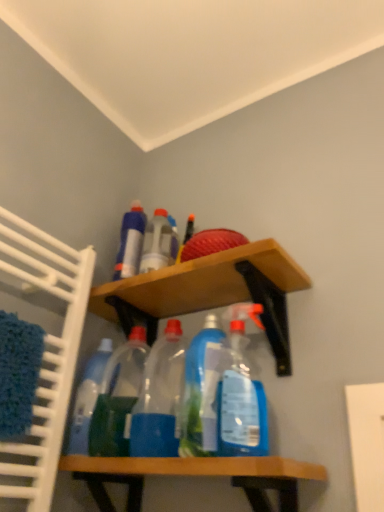
Question: Considering the relative positions of blue translucent spray bottle at center, marked as the 1th bottle in a right-to-left arrangement, and blue plastic bottle at upper center, the first bottle viewed from the left, in the image provided, is blue translucent spray bottle at center, marked as the 1th bottle in a right-to-left arrangement, to the left of blue plastic bottle at upper center, the first bottle viewed from the left, from the viewer's perspective?

Choices:
 (A) no
 (B) yes

Answer: (A)

Question: Would you say blue translucent spray bottle at center, marked as the 1th bottle in a right-to-left arrangement, is outside blue plastic bottle at upper center, marked as the 6th bottle in a right-to-left arrangement?

Choices:
 (A) no
 (B) yes

Answer: (B)

Question: Is blue translucent spray bottle at center, marked as the 1th bottle in a right-to-left arrangement, positioned in front of blue plastic bottle at upper center, marked as the 6th bottle in a right-to-left arrangement?

Choices:
 (A) no
 (B) yes

Answer: (B)

Question: Is blue translucent spray bottle at center, marked as the 1th bottle in a right-to-left arrangement, smaller than blue plastic bottle at upper center, the first bottle viewed from the left?

Choices:
 (A) no
 (B) yes

Answer: (A)

Question: Is blue translucent spray bottle at center, placed as the 6th bottle when sorted from left to right, facing towards blue plastic bottle at upper center, marked as the 6th bottle in a right-to-left arrangement?

Choices:
 (A) no
 (B) yes

Answer: (A)

Question: Would you consider blue translucent spray bottle at center, marked as the 1th bottle in a right-to-left arrangement, to be distant from blue plastic bottle at upper center, the first bottle viewed from the left?

Choices:
 (A) yes
 (B) no

Answer: (B)

Question: From the image's perspective, is wooden shelf at lower center, the first shelf from the bottom, beneath transparent plastic bottles at center, the fourth bottle positioned from the left?

Choices:
 (A) yes
 (B) no

Answer: (A)

Question: Is transparent plastic bottles at center, the fourth bottle positioned from the left, surrounded by wooden shelf at lower center, the first shelf from the bottom?

Choices:
 (A) yes
 (B) no

Answer: (B)

Question: Can you confirm if wooden shelf at lower center, the first shelf from the bottom, is positioned to the left of transparent plastic bottles at center, the fourth bottle positioned from the left?

Choices:
 (A) yes
 (B) no

Answer: (B)

Question: Is wooden shelf at lower center, the first shelf from the bottom, wider than transparent plastic bottles at center, the 3th bottle in the right-to-left sequence?

Choices:
 (A) yes
 (B) no

Answer: (A)

Question: Does wooden shelf at lower center, the second shelf when ordered from top to bottom, appear on the right side of transparent plastic bottles at center, the fourth bottle positioned from the left?

Choices:
 (A) no
 (B) yes

Answer: (B)

Question: From the image's perspective, is wooden shelf at lower center, the second shelf when ordered from top to bottom, above transparent plastic bottles at center, the fourth bottle positioned from the left?

Choices:
 (A) yes
 (B) no

Answer: (B)

Question: Is the depth of wooden shelf at upper center, which ranks as the second shelf in bottom-to-top order, greater than that of blue plastic bottle at upper center, marked as the 6th bottle in a right-to-left arrangement?

Choices:
 (A) yes
 (B) no

Answer: (B)